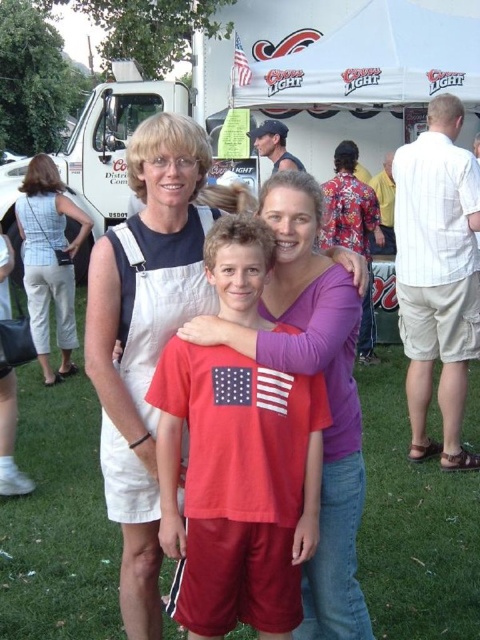
Question: In this image, where is white cotton apron at center located relative to american flag at upper center?

Choices:
 (A) above
 (B) below

Answer: (B)

Question: Among these points, which one is farthest from the camera?

Choices:
 (A) (47, 193)
 (B) (144, 362)
 (C) (205, 216)

Answer: (A)

Question: Among these points, which one is farthest from the camera?

Choices:
 (A) (34, 211)
 (B) (153, 333)
 (C) (84, 358)

Answer: (A)

Question: Which of the following is the closest to the observer?

Choices:
 (A) (108, 426)
 (B) (54, 296)

Answer: (A)

Question: Is white cotton overalls at center positioned in front of american flag at upper center?

Choices:
 (A) no
 (B) yes

Answer: (B)

Question: Is white cotton apron at center closer to camera compared to american flag at upper center?

Choices:
 (A) no
 (B) yes

Answer: (B)